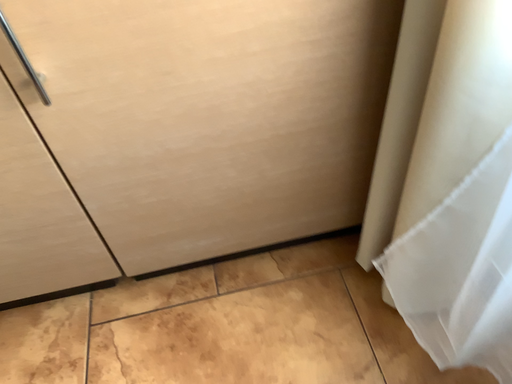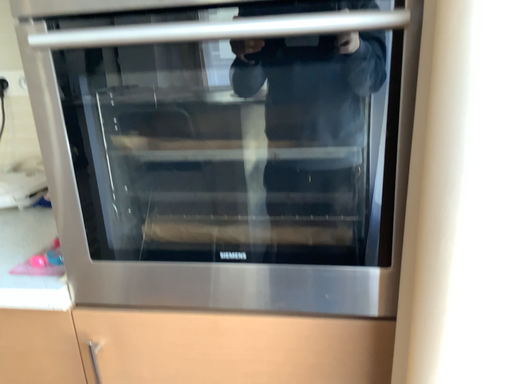
Question: Which way did the camera rotate in the video?

Choices:
 (A) rotated upward
 (B) rotated downward

Answer: (A)